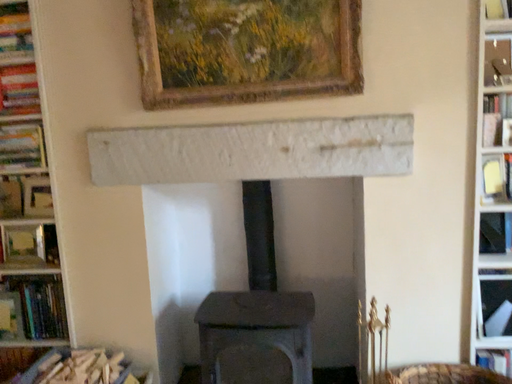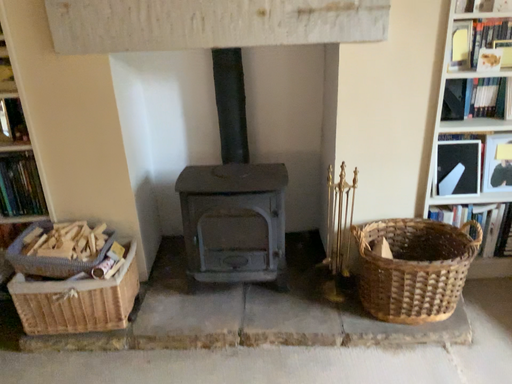
Question: How did the camera likely rotate when shooting the video?

Choices:
 (A) rotated right
 (B) rotated left

Answer: (A)